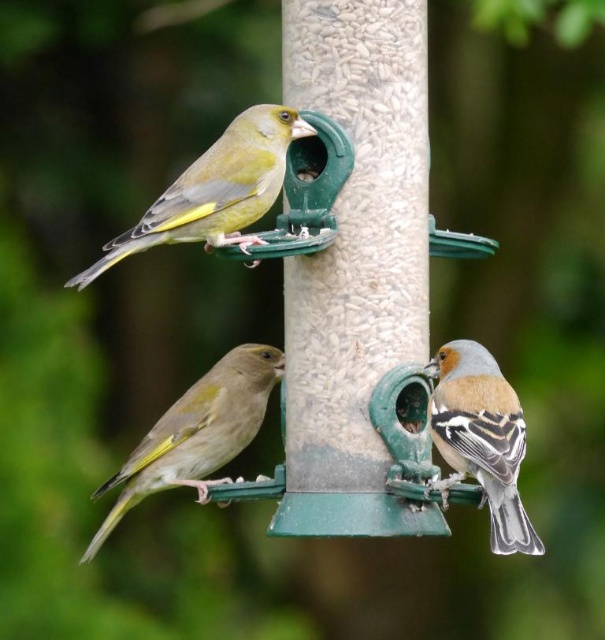
Question: Estimate the real-world distances between objects in this image. Which object is farther from the brown speckled feathers at right?

Choices:
 (A) green plastic bird feeder at center
 (B) green matte bird at center
 (C) green matte bird at upper left

Answer: (B)

Question: Based on their relative distances, which object is farther from the green plastic bird feeder at center?

Choices:
 (A) green matte bird at center
 (B) green matte bird at upper left

Answer: (A)

Question: Can you confirm if green matte bird at upper left is positioned to the right of brown speckled feathers at right?

Choices:
 (A) yes
 (B) no

Answer: (B)

Question: Which point is closer to the camera taking this photo?

Choices:
 (A) (361, 44)
 (B) (264, 176)

Answer: (B)

Question: Is green plastic bird feeder at center to the right of green matte bird at upper left from the viewer's perspective?

Choices:
 (A) yes
 (B) no

Answer: (A)

Question: Does green plastic bird feeder at center lie behind green matte bird at upper left?

Choices:
 (A) no
 (B) yes

Answer: (B)